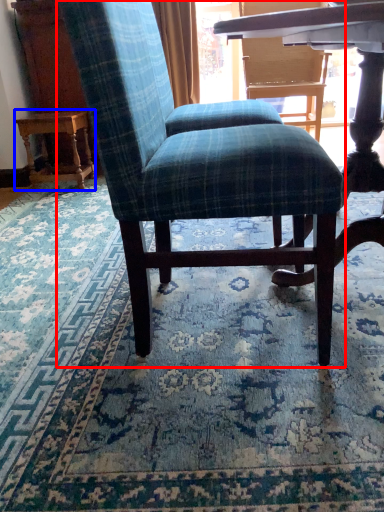
Question: Among these objects, which one is nearest to the camera, chair (highlighted by a red box) or table (highlighted by a blue box)?

Choices:
 (A) chair
 (B) table

Answer: (A)